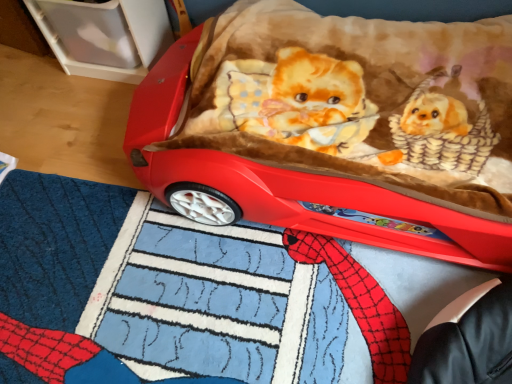
You are a GUI agent. You are given a task and a screenshot of the screen. Output one action in this format:
    pyautogui.click(x=<x>, y=<y>)
    Task: Click on the free region under blue plush mat at lower center (from a real-world perspective)
    The width and height of the screenshot is (512, 384).
    Given the screenshot: What is the action you would take?
    pyautogui.click(x=206, y=290)